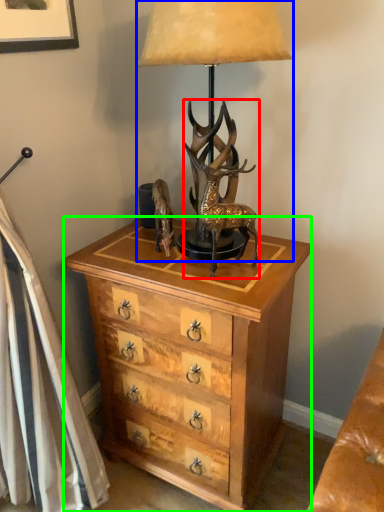
Question: Which object is the closest to the deer (highlighted by a red box)? Choose among these: lamp (highlighted by a blue box) or chest of drawers (highlighted by a green box).

Choices:
 (A) lamp
 (B) chest of drawers

Answer: (A)